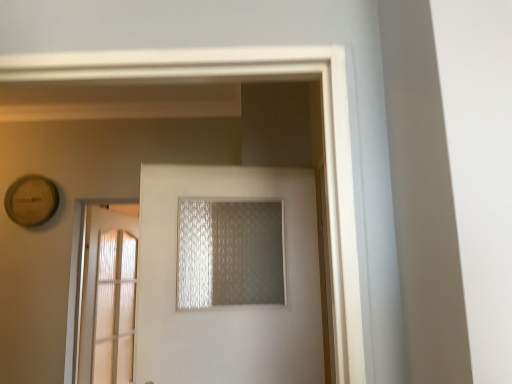
At what (x,y) coordinates should I click in order to perform the action: click on clear glass door at left, the first door in the back-to-front sequence. Please return your answer as a coordinate pair (x, y). This screenshot has width=512, height=384. Looking at the image, I should click on (109, 300).

I want to click on clear glass door at left, which is counted as the second door, starting from the front, so click(109, 300).

Considering the points (129, 366) and (213, 257), which point is behind, point (129, 366) or point (213, 257)?

The point (129, 366) is farther from the camera.

Who is more distant, clear glass door at left, the first door in the back-to-front sequence, or translucent textured glass at center?

clear glass door at left, the first door in the back-to-front sequence, is further from the camera.

Considering the relative sizes of clear glass door at left, marked as the 1th door in a left-to-right arrangement, and translucent textured glass at center in the image provided, is clear glass door at left, marked as the 1th door in a left-to-right arrangement, shorter than translucent textured glass at center?

In fact, clear glass door at left, marked as the 1th door in a left-to-right arrangement, may be taller than translucent textured glass at center.

Is clear glass door at left, marked as the 1th door in a left-to-right arrangement, to the left or to the right of translucent textured glass at center in the image?

clear glass door at left, marked as the 1th door in a left-to-right arrangement, is positioned on translucent textured glass at center's left side.

Considering their positions, is clear glass door at left, marked as the 1th door in a left-to-right arrangement, located in front of or behind white frosted glass door at center, the second door from the back?

clear glass door at left, marked as the 1th door in a left-to-right arrangement, is positioned farther from the viewer than white frosted glass door at center, the second door from the back.

Is clear glass door at left, marked as the 1th door in a left-to-right arrangement, thinner than white frosted glass door at center, which is counted as the first door, starting from the right?

Yes.

Locate an element on the screen. door that appears above the clear glass door at left, the first door in the back-to-front sequence (from the image's perspective) is located at coordinates (229, 306).

Is translucent textured glass at center next to clear glass door at left, positioned as the 2th door in right-to-left order, and touching it?

No, translucent textured glass at center is not making contact with clear glass door at left, positioned as the 2th door in right-to-left order.

From a real-world perspective, is translucent textured glass at center located higher than clear glass door at left, which is counted as the second door, starting from the front?

Yes, from a real-world perspective, translucent textured glass at center is on top of clear glass door at left, which is counted as the second door, starting from the front.

In the scene shown: Which of these two, translucent textured glass at center or clear glass door at left, positioned as the 2th door in right-to-left order, is bigger?

With larger size is clear glass door at left, positioned as the 2th door in right-to-left order.

Is point (211, 294) closer or farther from the camera than point (98, 230)?

Point (211, 294) is closer to the camera than point (98, 230).

Is the surface of translucent textured glass at center in direct contact with white frosted glass door at center, which is counted as the first door, starting from the right?

No, translucent textured glass at center is not next to white frosted glass door at center, which is counted as the first door, starting from the right.

Which is in front, point (252, 270) or point (268, 311)?

Point (268, 311)

Can you confirm if translucent textured glass at center is thinner than white frosted glass door at center, which is the second door from left to right?

No.

Is translucent textured glass at center positioned with its back to white frosted glass door at center, arranged as the 1th door when viewed from the front?

Yes.

Can you confirm if white frosted glass door at center, which is counted as the first door, starting from the right, is taller than clear glass door at left, which is counted as the second door, starting from the front?

No.

Which is more to the right, white frosted glass door at center, which is counted as the first door, starting from the right, or clear glass door at left, which is counted as the second door, starting from the front?

white frosted glass door at center, which is counted as the first door, starting from the right, is more to the right.

Is white frosted glass door at center, arranged as the 1th door when viewed from the front, facing away from clear glass door at left, which is counted as the second door, starting from the front?

Yes, white frosted glass door at center, arranged as the 1th door when viewed from the front,'s orientation is away from clear glass door at left, which is counted as the second door, starting from the front.

From the image's perspective, which one is positioned higher, white frosted glass door at center, arranged as the 1th door when viewed from the front, or clear glass door at left, positioned as the 2th door in right-to-left order?

white frosted glass door at center, arranged as the 1th door when viewed from the front.

Looking at this image, from a real-world perspective, is white frosted glass door at center, arranged as the 1th door when viewed from the front, physically located above or below translucent textured glass at center?

white frosted glass door at center, arranged as the 1th door when viewed from the front, is situated lower than translucent textured glass at center in the real world.

Would you say white frosted glass door at center, which is counted as the first door, starting from the right, is inside or outside translucent textured glass at center?

white frosted glass door at center, which is counted as the first door, starting from the right, cannot be found inside translucent textured glass at center.

Is white frosted glass door at center, the second door from the back, at the right side of translucent textured glass at center?

No.

Which is closer, (153, 185) or (274, 228)?

The point (153, 185) is more forward.

Starting from the translucent textured glass at center, which door is the 2nd one to the left? Please provide its 2D coordinates.

[(109, 300)]

Where is `door on the right of clear glass door at left, the first door in the back-to-front sequence`? This screenshot has height=384, width=512. door on the right of clear glass door at left, the first door in the back-to-front sequence is located at coordinates point(229,306).

From the image, which object appears to be farther from clear glass door at left, which is counted as the second door, starting from the front, white frosted glass door at center, arranged as the 1th door when viewed from the front, or translucent textured glass at center?

translucent textured glass at center is further to clear glass door at left, which is counted as the second door, starting from the front.

Based on their spatial positions, is translucent textured glass at center or white frosted glass door at center, the second door from the back, further from clear glass door at left, the first door in the back-to-front sequence?

translucent textured glass at center.

Considering their positions, is clear glass door at left, marked as the 1th door in a left-to-right arrangement, positioned further to white frosted glass door at center, which is counted as the first door, starting from the right, than translucent textured glass at center?

clear glass door at left, marked as the 1th door in a left-to-right arrangement, is positioned further to the anchor white frosted glass door at center, which is counted as the first door, starting from the right.

Based on the photo, which object lies nearer to the anchor point translucent textured glass at center, clear glass door at left, marked as the 1th door in a left-to-right arrangement, or white frosted glass door at center, arranged as the 1th door when viewed from the front?

The object closer to translucent textured glass at center is white frosted glass door at center, arranged as the 1th door when viewed from the front.

Looking at the image, which one is located closer to white frosted glass door at center, which is counted as the first door, starting from the right, translucent textured glass at center or clear glass door at left, the first door in the back-to-front sequence?

Based on the image, translucent textured glass at center appears to be nearer to white frosted glass door at center, which is counted as the first door, starting from the right.

From the image, which object appears to be farther from translucent textured glass at center, white frosted glass door at center, which is counted as the first door, starting from the right, or clear glass door at left, the first door in the back-to-front sequence?

clear glass door at left, the first door in the back-to-front sequence.

Where is `door situated between clear glass door at left, the first door in the back-to-front sequence, and translucent textured glass at center from left to right`? door situated between clear glass door at left, the first door in the back-to-front sequence, and translucent textured glass at center from left to right is located at coordinates (229, 306).